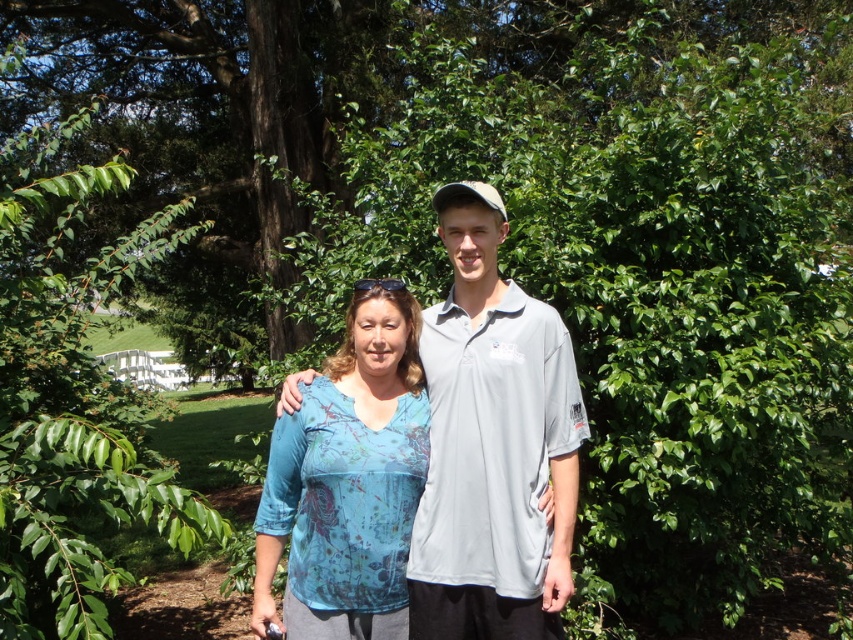
You are a photographer trying to capture a clear shot of both the blue printed shirt at center and the blue printed blouse at center. Since they are both in the center, which one should you focus on to ensure the other is also in focus?

The blue printed shirt at center is located above the blue printed blouse at center. To ensure both are in focus, focus on the shirt since it is closer to the camera, and the blouse will naturally be in focus as it is behind.

You are a photographer taking a picture of the green leafy tree at upper left and the blue printed blouse at center. Which object will appear closer to the camera in the photo?

The green leafy tree at upper left will appear closer to the camera in the photo because it is positioned further to the viewer than the blue printed blouse at center.

You are a photographer trying to capture a photo of the green leafy tree at upper left and the blue printed shirt at center. Which object is smaller in the photo?

The green leafy tree at upper left is smaller than the blue printed shirt at center in the photo.